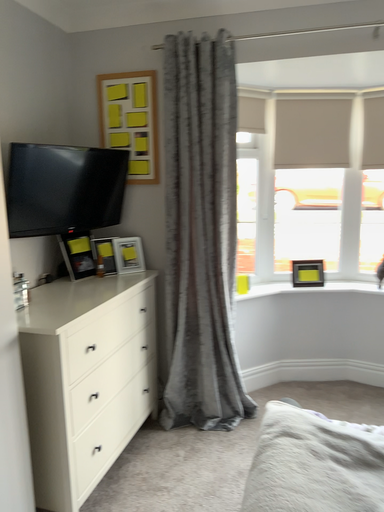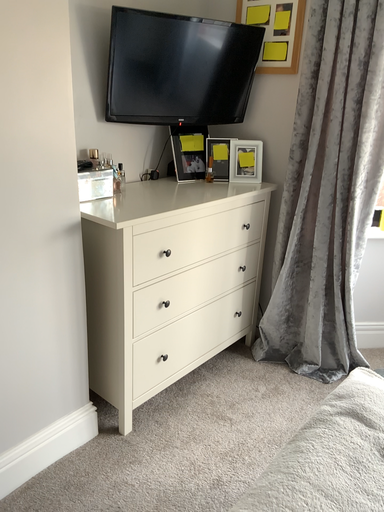
Question: How did the camera likely rotate when shooting the video?

Choices:
 (A) rotated right
 (B) rotated left

Answer: (B)